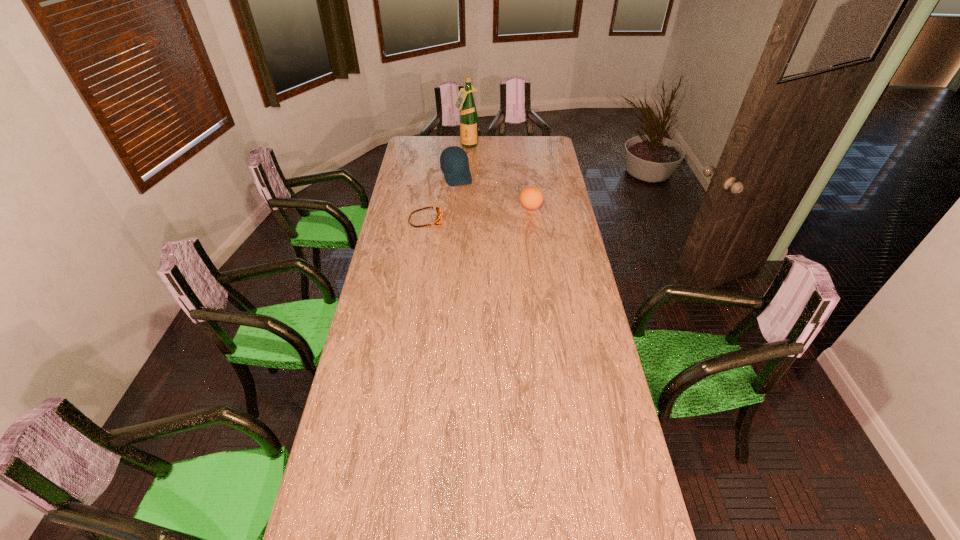
This screenshot has width=960, height=540. In order to click on vacant space on the desktop that is between the goggles and the third tallest object and is positioned on the front-facing side of the tallest object in this screenshot , I will do `click(482, 213)`.

Identify the location of free space on the desktop that is between the goggles and the third tallest object and is positioned on the front-facing side of the second tallest object. This screenshot has width=960, height=540. (474, 214).